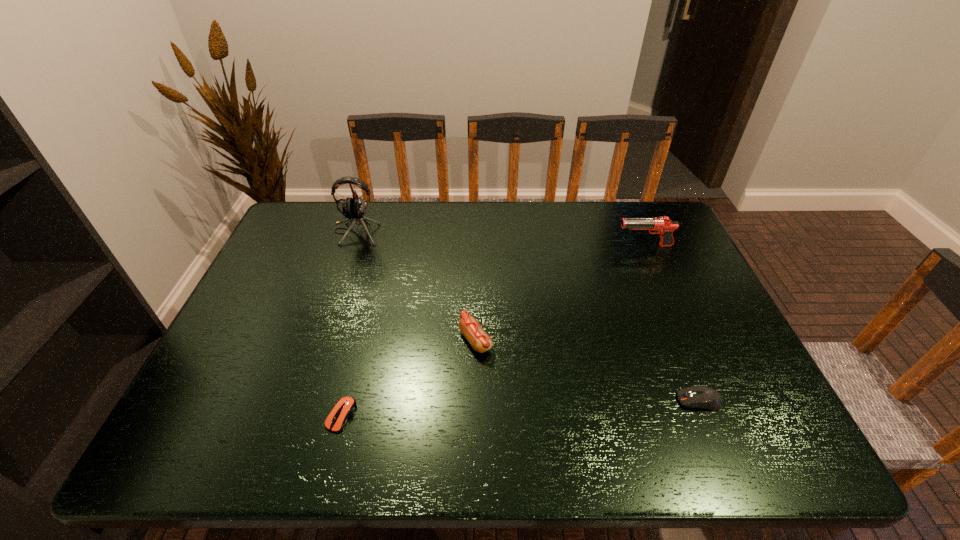
The height and width of the screenshot is (540, 960). I want to click on vacant space in between the fourth shortest object and the third shortest object, so click(560, 293).

Image resolution: width=960 pixels, height=540 pixels. Identify the location of free space between the earphone and the right computer mouse. (528, 316).

Identify the location of free spot between the third farthest object and the earphone. (416, 286).

Image resolution: width=960 pixels, height=540 pixels. Identify the location of vacant area that lies between the left computer mouse and the tallest object. coord(348,323).

Where is `vacant space that is in between the second shortest object and the shortest object`? vacant space that is in between the second shortest object and the shortest object is located at coordinates [520, 408].

At what (x,y) coordinates should I click in order to perform the action: click on free space between the second tallest object and the fourth tallest object. Please return your answer as a coordinate pair (x, y). The image size is (960, 540). Looking at the image, I should click on (672, 323).

Identify the location of vacant point located between the tallest object and the fourth tallest object. (528, 316).

Find the location of a particular element. vacant area that lies between the fourth tallest object and the third tallest object is located at coordinates (588, 370).

This screenshot has width=960, height=540. I want to click on empty space between the taller computer mouse and the shortest object, so click(x=520, y=408).

At what (x,y) coordinates should I click in order to perform the action: click on free area in between the sausage and the tallest object. Please return your answer as a coordinate pair (x, y). Image resolution: width=960 pixels, height=540 pixels. Looking at the image, I should click on (416, 286).